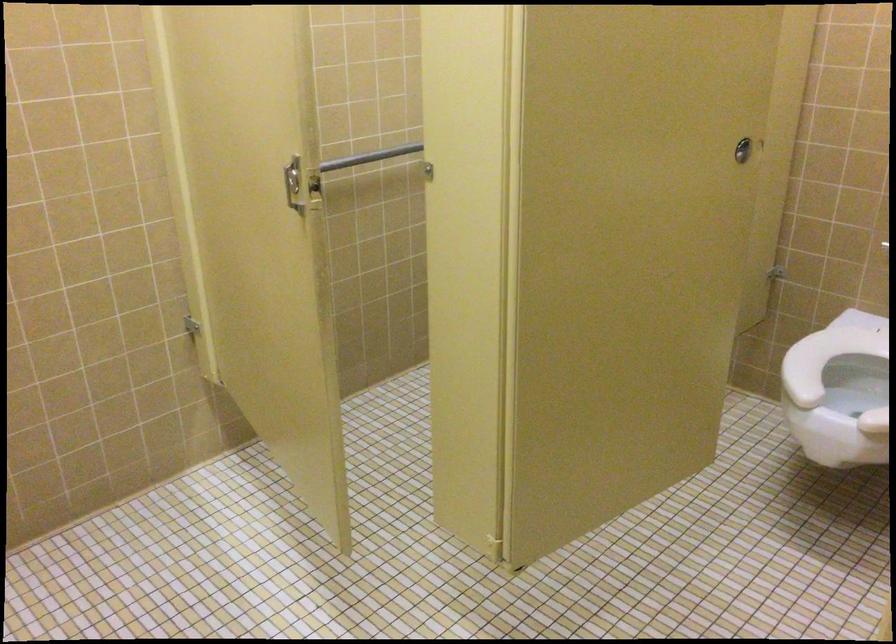
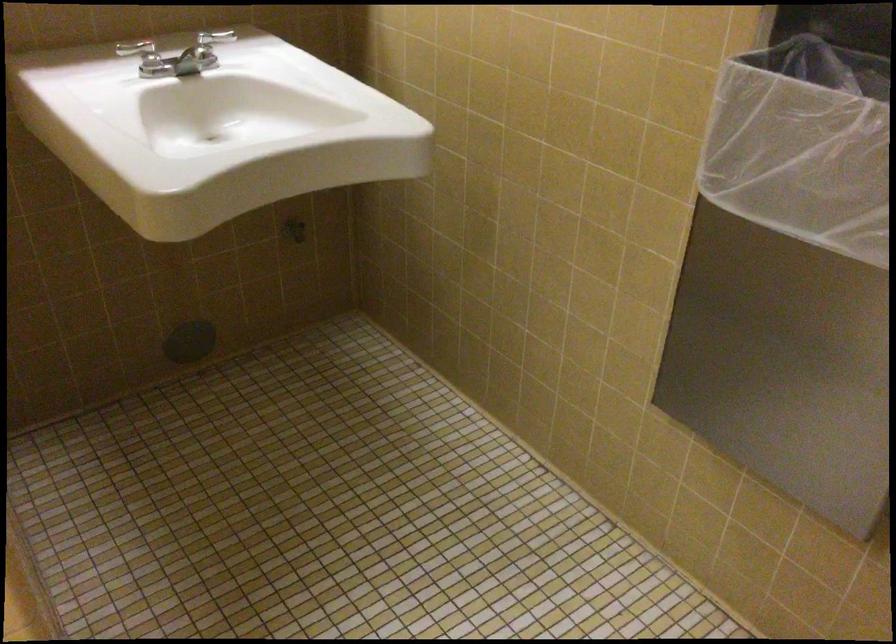
Based on the photo, the first image is from the beginning of the video and the second image is from the end. How did the camera likely rotate when shooting the video?

The camera rotated toward right-down.